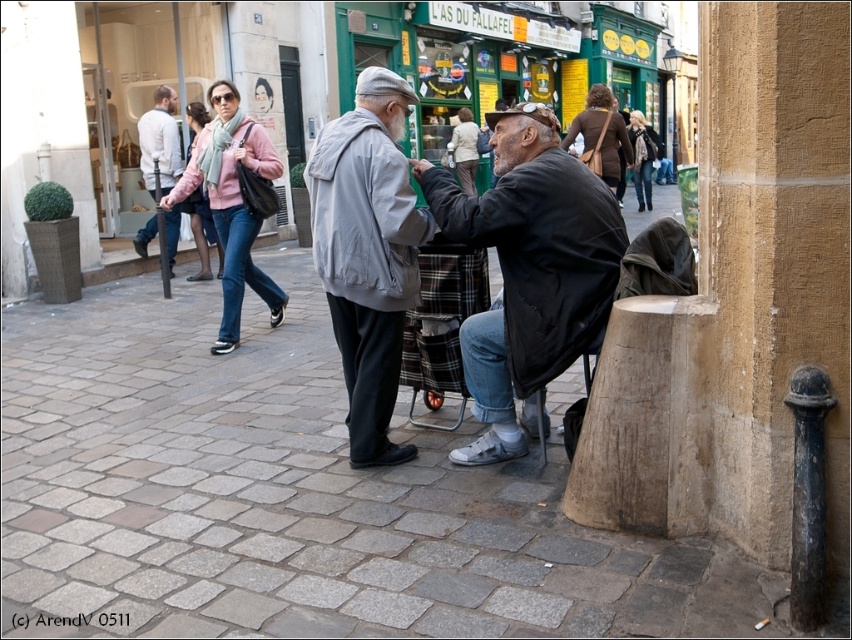
Is gray fabric jacket at center further to the viewer compared to plaid fabric chair at center?

No, gray fabric jacket at center is closer to the viewer.

Is gray fabric jacket at center positioned before plaid fabric chair at center?

That is True.

Does point (401, 84) come in front of point (421, 282)?

Yes, point (401, 84) is in front of point (421, 282).

The width and height of the screenshot is (852, 640). I want to click on gray fabric jacket at center, so click(367, 252).

Does point (511, 136) lie behind point (314, 264)?

No, it is not.

Between dark gray jacket at center and gray fabric jacket at center, which one has less height?

dark gray jacket at center is shorter.

What are the coordinates of `dark gray jacket at center` in the screenshot? It's located at (528, 272).

Does dark gray jacket at center have a smaller size compared to plaid fabric chair at center?

No.

Can you confirm if dark gray jacket at center is positioned below plaid fabric chair at center?

No.

Between point (532, 243) and point (433, 339), which one is positioned in front?

Point (532, 243) is more forward.

Locate an element on the screen. This screenshot has width=852, height=640. dark gray jacket at center is located at coordinates (528, 272).